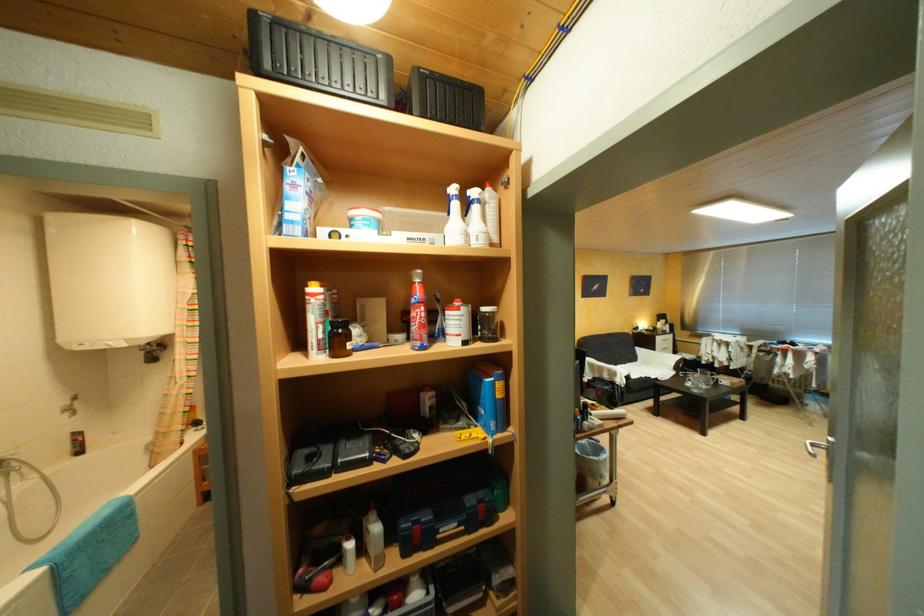
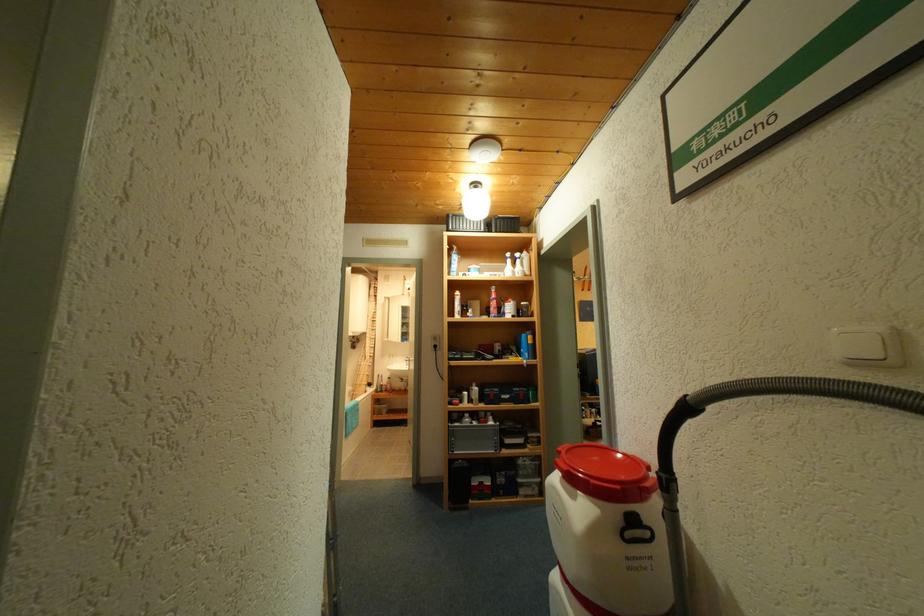
Where in the second image is the point corresponding to pixel 382 517 from the first image?

(483, 386)